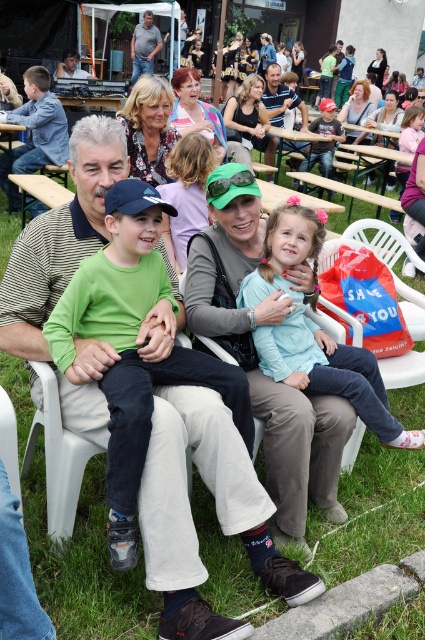
You are standing in the park and see two points in the image. Which point is closer to you, point (319, 218) or point (136, 45)?

Point (319, 218) is closer to you than point (136, 45).

You are standing at the camera position and want to throw a frisbee to a friend. You have two options to choose where to throw it to. The first option is to throw it to point (135, 234) and the second option is to throw it to point (149, 19). Which point is closer to you?

Point (135, 234) is closer to the camera than point (149, 19), so you should choose the first option.